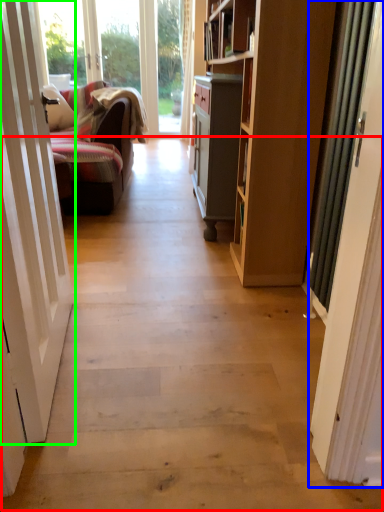
Question: Based on their relative distances, which object is nearer to path (highlighted by a red box)? Choose from door (highlighted by a blue box) and door (highlighted by a green box).

Choices:
 (A) door
 (B) door

Answer: (B)